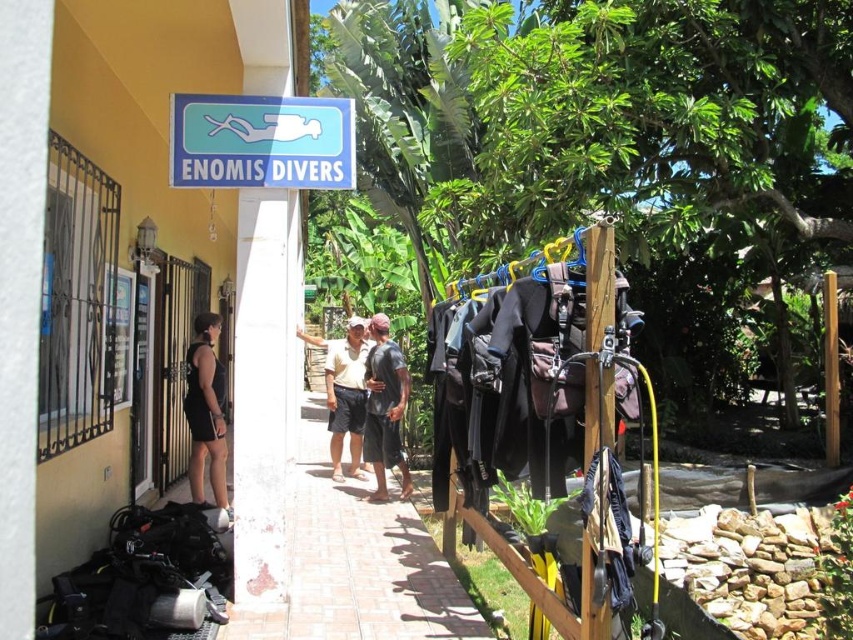
Question: Which point appears farthest from the camera in this image?

Choices:
 (A) (585, 412)
 (B) (189, 356)

Answer: (B)

Question: Where is blue plastic sign at upper center located in relation to light brown cotton shorts at center in the image?

Choices:
 (A) right
 (B) left

Answer: (A)

Question: Can you confirm if wooden pole at center is thinner than black cotton shorts at center?

Choices:
 (A) yes
 (B) no

Answer: (A)

Question: Is brick pavement at center positioned before light brown cotton shorts at center?

Choices:
 (A) yes
 (B) no

Answer: (A)

Question: Which object is positioned closest to the black cotton shorts at center?

Choices:
 (A) black matte wetsuit at left
 (B) wooden pole at center

Answer: (A)

Question: Which point is farther from the camera taking this photo?

Choices:
 (A) (587, 611)
 (B) (250, 115)
 (C) (386, 440)
 (D) (339, 481)

Answer: (D)